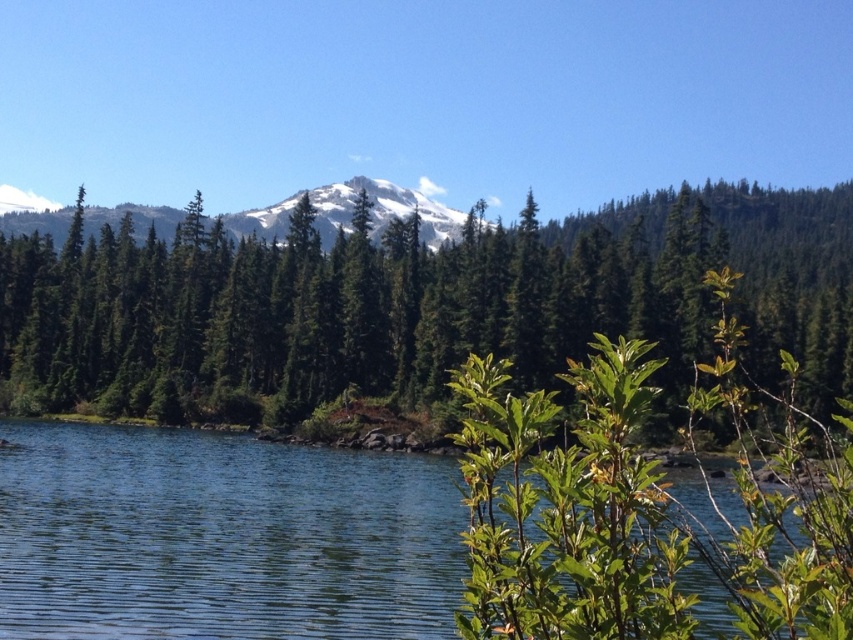
Does green matte tree at center appear over snowy white mountain at center?

Actually, green matte tree at center is below snowy white mountain at center.

Is green matte tree at center bigger than snowy white mountain at center?

Yes, green matte tree at center is bigger than snowy white mountain at center.

Does point (44, 308) come behind point (425, 236)?

No.

Image resolution: width=853 pixels, height=640 pixels. I want to click on green matte tree at center, so click(x=412, y=304).

Does clear blue water at center have a larger size compared to snowy white mountain at center?

No, clear blue water at center is not bigger than snowy white mountain at center.

Locate an element on the screen. The width and height of the screenshot is (853, 640). clear blue water at center is located at coordinates (221, 536).

You are a GUI agent. You are given a task and a screenshot of the screen. Output one action in this format:
    pyautogui.click(x=<x>, y=<y>)
    Task: Click on the clear blue water at center
    
    Given the screenshot: What is the action you would take?
    pyautogui.click(x=221, y=536)

Is green matte tree at center bigger than clear blue water at center?

Yes, green matte tree at center is bigger than clear blue water at center.

This screenshot has height=640, width=853. Identify the location of green matte tree at center. (412, 304).

You are a GUI agent. You are given a task and a screenshot of the screen. Output one action in this format:
    pyautogui.click(x=<x>, y=<y>)
    Task: Click on the green matte tree at center
    The width and height of the screenshot is (853, 640).
    Given the screenshot: What is the action you would take?
    pyautogui.click(x=412, y=304)